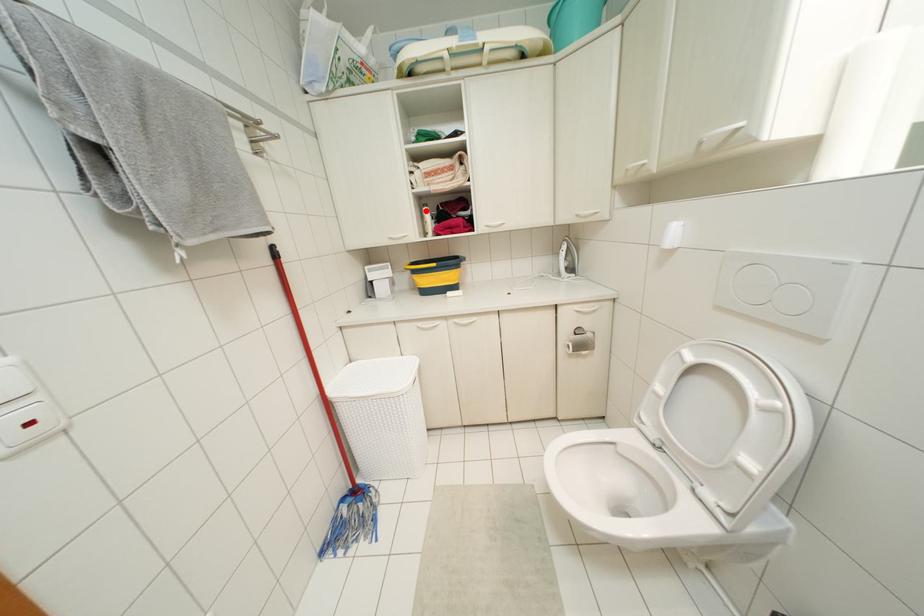
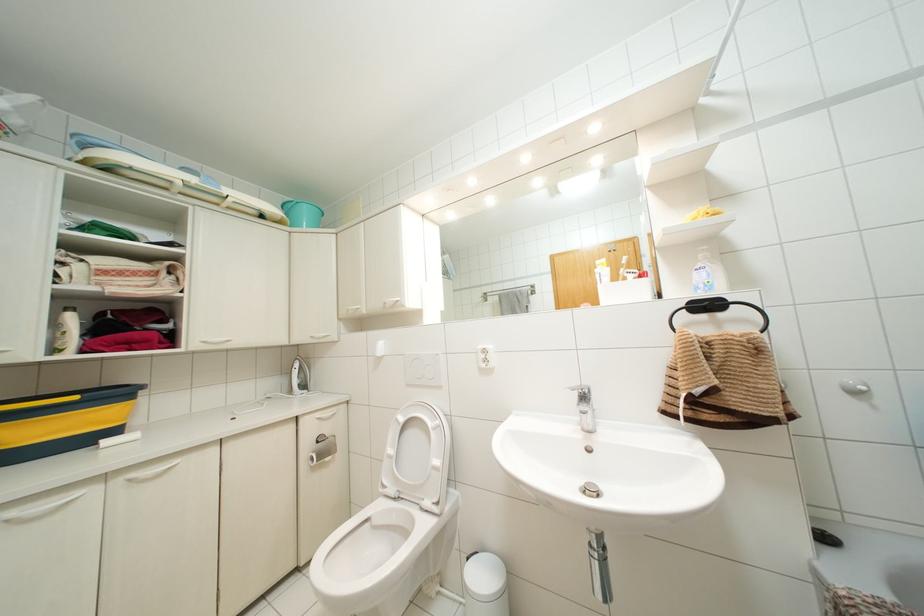
In the second image, find the point that corresponds to the highlighted location in the first image.

(70, 317)